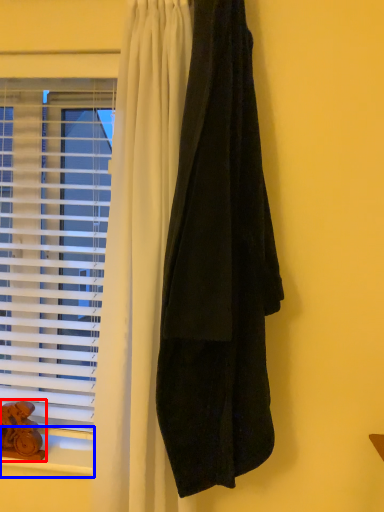
Question: Which object appears farthest to the camera in this image, animal (highlighted by a red box) or window sill (highlighted by a blue box)?

Choices:
 (A) animal
 (B) window sill

Answer: (A)